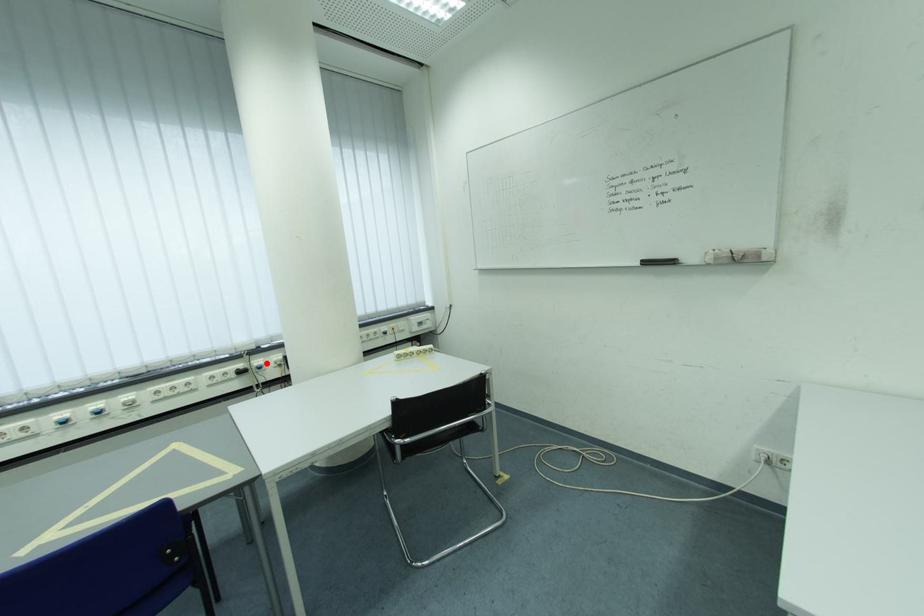
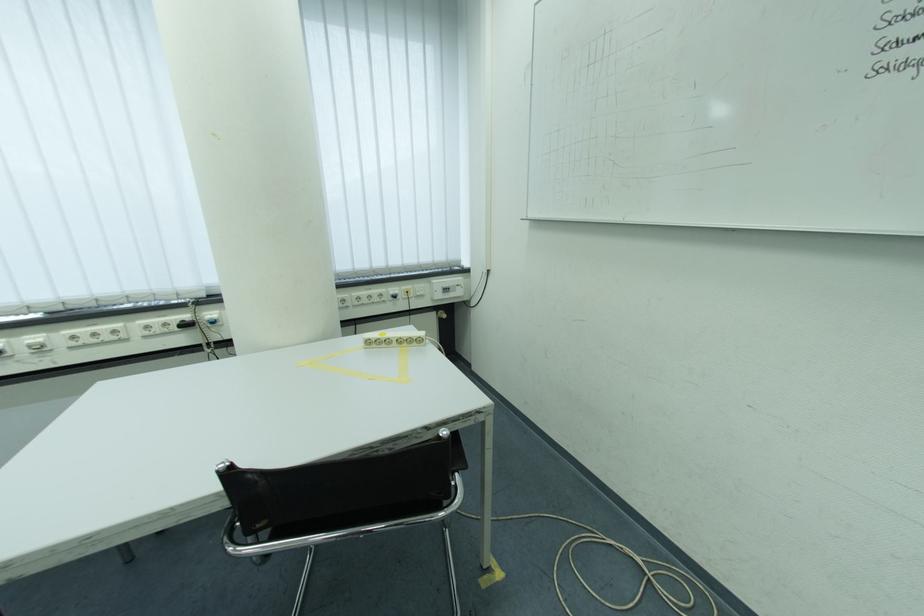
Locate, in the second image, the point that corresponds to the highlighted location in the first image.

(217, 315)